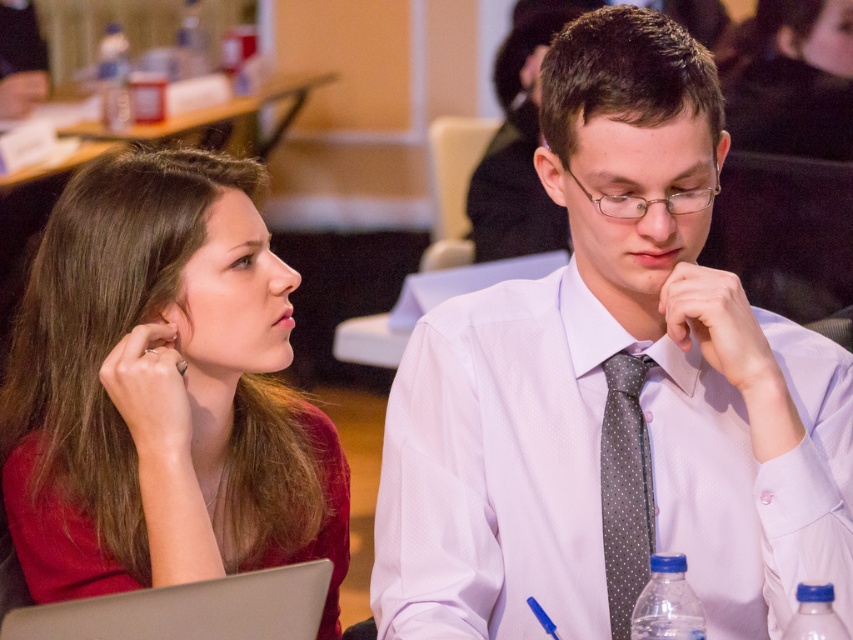
Is white dotted tie at center positioned before gray dotted tie at center?

Yes.

Describe the element at coordinates (614, 390) in the screenshot. I see `white dotted tie at center` at that location.

Locate an element on the screen. white dotted tie at center is located at coordinates (614, 390).

This screenshot has width=853, height=640. I want to click on white dotted tie at center, so click(614, 390).

Does matte red shirt at left appear on the right side of gray dotted tie at center?

Incorrect, matte red shirt at left is not on the right side of gray dotted tie at center.

Which is more to the left, matte red shirt at left or gray dotted tie at center?

matte red shirt at left is more to the left.

Who is more forward, [183,348] or [618,458]?

Point [618,458] is more forward.

Find the location of a particular element. This screenshot has height=640, width=853. matte red shirt at left is located at coordinates (161, 392).

Between point (384, 433) and point (231, 529), which one is positioned behind?

The point (231, 529) is more distant.

Which is more to the left, white dotted tie at center or matte red shirt at left?

From the viewer's perspective, matte red shirt at left appears more on the left side.

Does point (798, 570) lie behind point (91, 448)?

No, (798, 570) is in front of (91, 448).

Where is `white dotted tie at center`? white dotted tie at center is located at coordinates (614, 390).